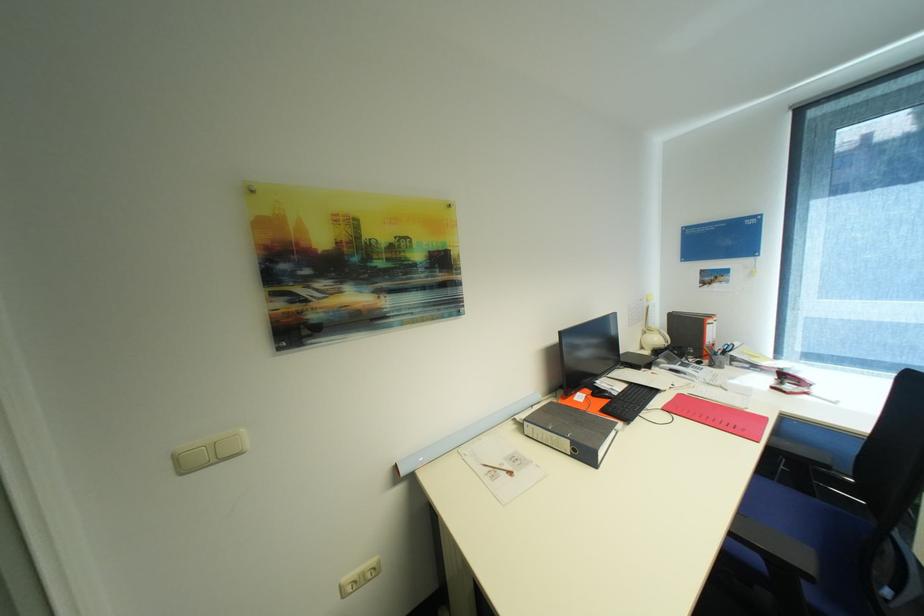
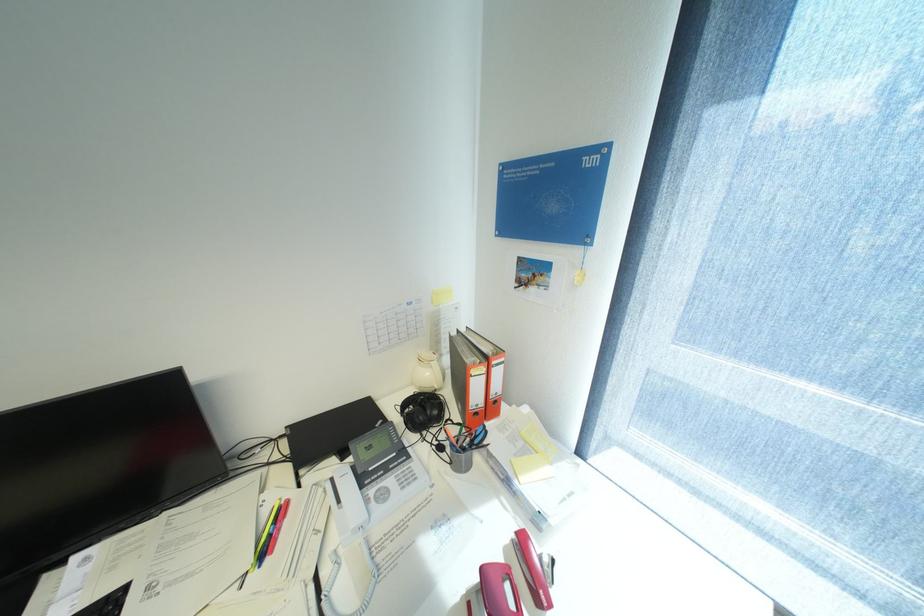
From the picture: Which direction would the cameraman need to move to produce the second image?

The cameraman walked toward right, forward.